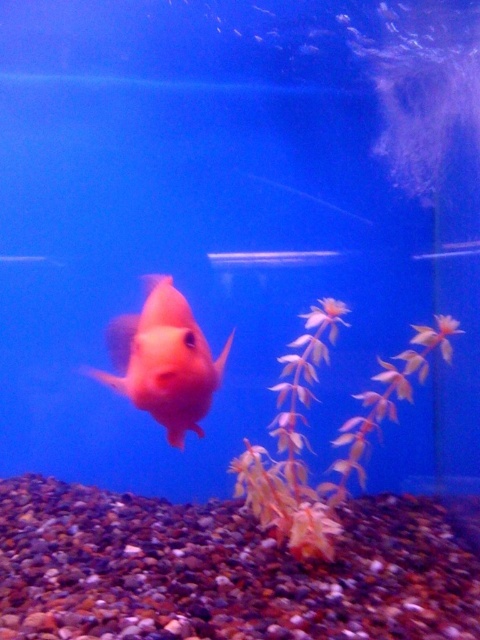
Question: Which of the following is the farthest from the observer?

Choices:
 (A) 367,422
 (B) 151,342

Answer: (A)

Question: Is yellow matte plant at center to the left of matte orange fish at center from the viewer's perspective?

Choices:
 (A) yes
 (B) no

Answer: (B)

Question: Which point appears farthest from the camera in this image?

Choices:
 (A) (157, 352)
 (B) (302, 339)

Answer: (B)

Question: Is yellow matte plant at center smaller than matte orange fish at center?

Choices:
 (A) yes
 (B) no

Answer: (B)

Question: Can you confirm if yellow matte plant at center is positioned to the right of matte orange fish at center?

Choices:
 (A) no
 (B) yes

Answer: (B)